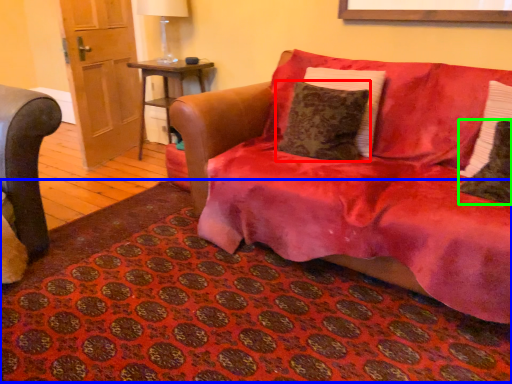
Question: Which object is the closest to the pillow (highlighted by a red box)? Choose among these: mat (highlighted by a blue box) or pillow (highlighted by a green box).

Choices:
 (A) mat
 (B) pillow

Answer: (B)